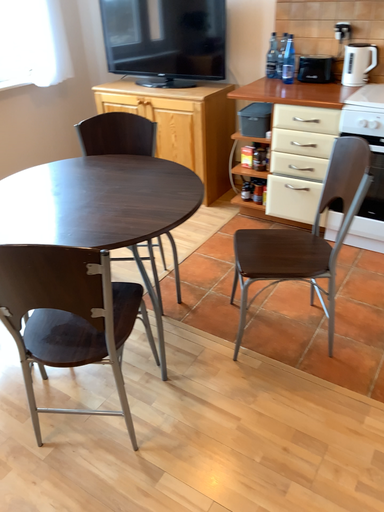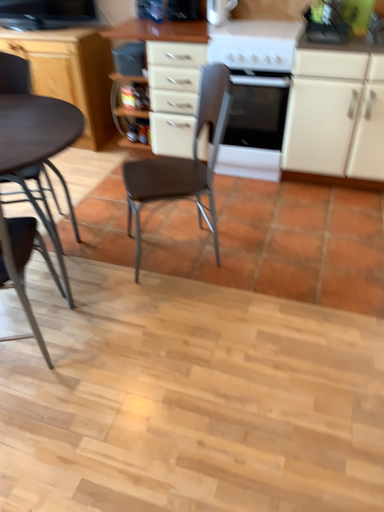
Question: How did the camera likely rotate when shooting the video?

Choices:
 (A) rotated left
 (B) rotated right

Answer: (B)